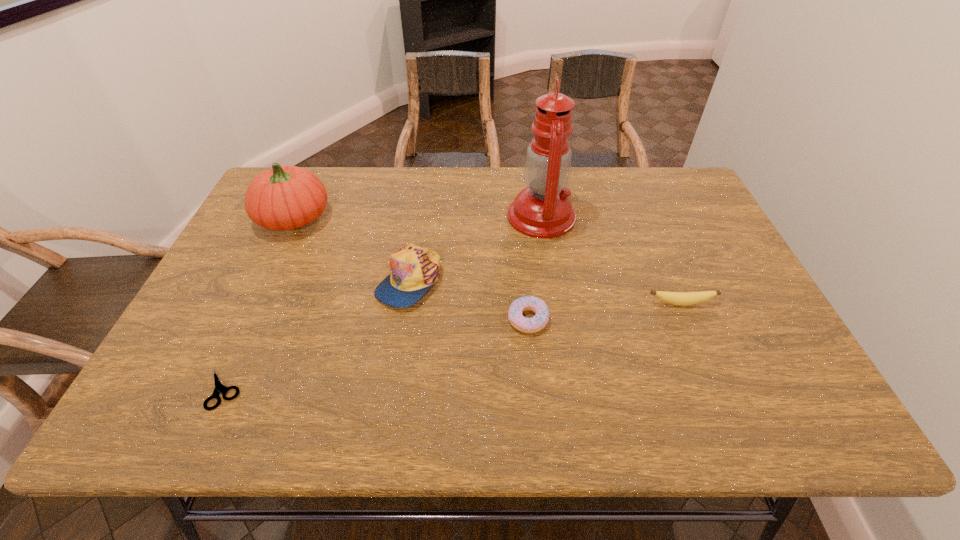
Find the location of a particular element. This screenshot has height=540, width=960. the tallest object is located at coordinates (543, 210).

Find the location of a particular element. The height and width of the screenshot is (540, 960). pumpkin is located at coordinates point(284,197).

Image resolution: width=960 pixels, height=540 pixels. Identify the location of cap. (414, 269).

Find the location of a particular element. This screenshot has height=540, width=960. the third tallest object is located at coordinates (414, 269).

This screenshot has height=540, width=960. I want to click on banana, so click(x=677, y=298).

Locate an element on the screen. doughnut is located at coordinates (535, 324).

Locate an element on the screen. the nearest object is located at coordinates (219, 388).

I want to click on the shortest object, so click(219, 388).

Image resolution: width=960 pixels, height=540 pixels. Find the location of `vacant space located on the left of the oil lamp`. vacant space located on the left of the oil lamp is located at coordinates (453, 217).

Locate an element on the screen. vacant space positioned 0.130m on the right of the second tallest object is located at coordinates (374, 219).